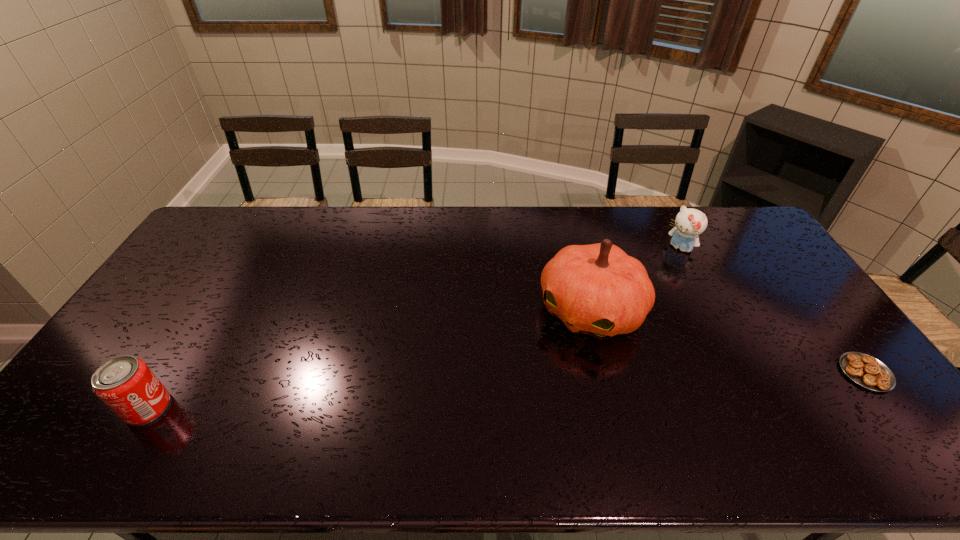
I want to click on vacant area situated on the front-facing side of the kitten, so click(652, 276).

Locate an element on the screen. The image size is (960, 540). vacant region located 0.070m on the front-facing side of the kitten is located at coordinates click(x=662, y=266).

Where is `free region located on the front-facing side of the tallest object`? The image size is (960, 540). free region located on the front-facing side of the tallest object is located at coordinates point(535,386).

At what (x,y) coordinates should I click in order to perform the action: click on vacant space located 0.080m on the front-facing side of the tallest object. Please return your answer as a coordinate pair (x, y). The height and width of the screenshot is (540, 960). Looking at the image, I should click on (552, 363).

Where is `vacant space located on the front-facing side of the tallest object`? This screenshot has width=960, height=540. vacant space located on the front-facing side of the tallest object is located at coordinates (528, 394).

This screenshot has width=960, height=540. In order to click on object that is at the far edge in this screenshot , I will do `click(690, 223)`.

This screenshot has height=540, width=960. I want to click on can located in the near edge section of the desktop, so click(x=125, y=384).

At what (x,y) coordinates should I click in order to perform the action: click on pastry present at the near edge. Please return your answer as a coordinate pair (x, y). This screenshot has height=540, width=960. Looking at the image, I should click on [867, 371].

The image size is (960, 540). Identify the location of object at the left edge. (125, 384).

Where is `object present at the right edge`? The image size is (960, 540). object present at the right edge is located at coordinates (867, 371).